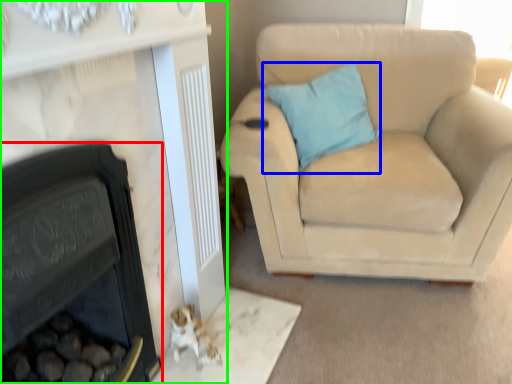
Question: Which object is the closest to the fireplace (highlighted by a red box)? Choose among these: pillow (highlighted by a blue box) or fireplace (highlighted by a green box).

Choices:
 (A) pillow
 (B) fireplace

Answer: (B)